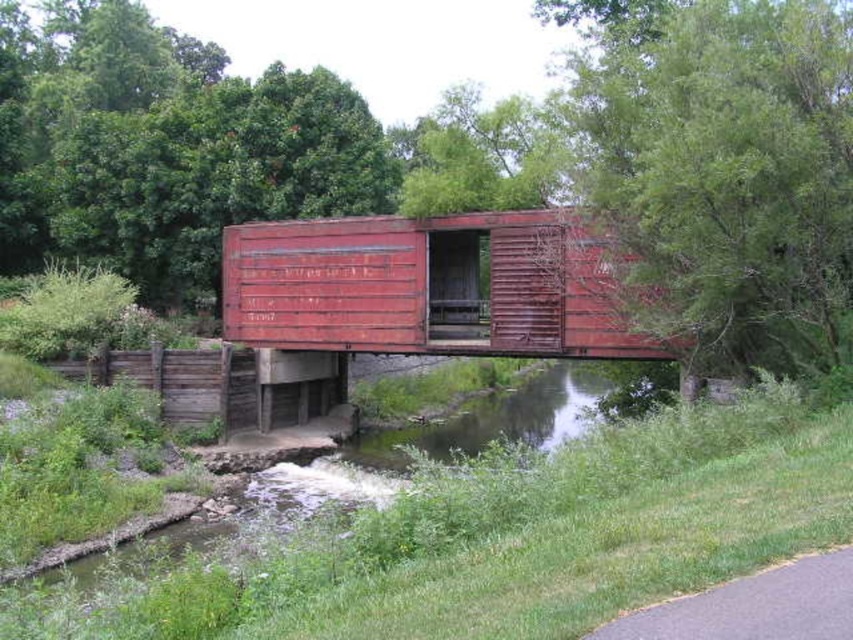
Question: In this image, where is rusty metal shipping container at center located relative to green grassy river at lower center?

Choices:
 (A) left
 (B) right

Answer: (A)

Question: Which point is farther from the camera taking this photo?

Choices:
 (A) (577, 253)
 (B) (397, 461)

Answer: (B)

Question: Which point appears farthest from the camera in this image?

Choices:
 (A) (254, 234)
 (B) (126, 566)

Answer: (A)

Question: Observing the image, what is the correct spatial positioning of rusty metal shipping container at center in reference to green grassy river at lower center?

Choices:
 (A) right
 (B) left

Answer: (B)

Question: Where is rusty metal shipping container at center located in relation to green grassy river at lower center in the image?

Choices:
 (A) above
 (B) below

Answer: (A)